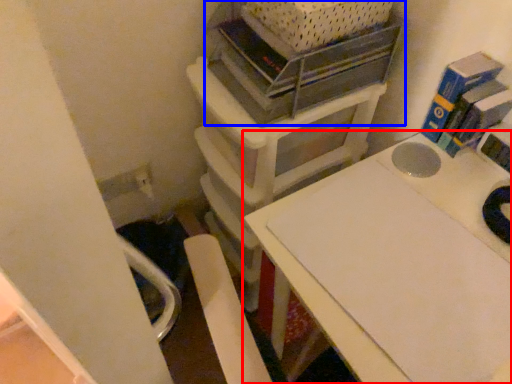
Question: Which of the following is the closest to the observer, table (highlighted by a red box) or shelf (highlighted by a blue box)?

Choices:
 (A) table
 (B) shelf

Answer: (A)